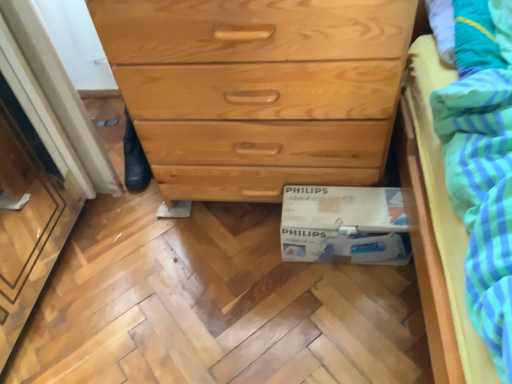
Question: Is white cardboard box at lower center with natural wood chest of drawers at center?

Choices:
 (A) yes
 (B) no

Answer: (B)

Question: Can you confirm if white cardboard box at lower center is positioned to the left of natural wood chest of drawers at center?

Choices:
 (A) no
 (B) yes

Answer: (A)

Question: From the image's perspective, is white cardboard box at lower center on natural wood chest of drawers at center?

Choices:
 (A) no
 (B) yes

Answer: (A)

Question: Is white cardboard box at lower center positioned far away from natural wood chest of drawers at center?

Choices:
 (A) yes
 (B) no

Answer: (B)

Question: Does white cardboard box at lower center have a smaller size compared to natural wood chest of drawers at center?

Choices:
 (A) yes
 (B) no

Answer: (A)

Question: Is white cardboard box at lower center oriented towards natural wood chest of drawers at center?

Choices:
 (A) no
 (B) yes

Answer: (A)

Question: Does natural wood chest of drawers at center have a lesser height compared to white cardboard box at lower center?

Choices:
 (A) no
 (B) yes

Answer: (A)

Question: From a real-world perspective, is natural wood chest of drawers at center over white cardboard box at lower center?

Choices:
 (A) no
 (B) yes

Answer: (B)

Question: From a real-world perspective, is natural wood chest of drawers at center located beneath white cardboard box at lower center?

Choices:
 (A) no
 (B) yes

Answer: (A)

Question: Is natural wood chest of drawers at center turned away from white cardboard box at lower center?

Choices:
 (A) yes
 (B) no

Answer: (B)

Question: Considering the relative sizes of natural wood chest of drawers at center and white cardboard box at lower center in the image provided, is natural wood chest of drawers at center smaller than white cardboard box at lower center?

Choices:
 (A) yes
 (B) no

Answer: (B)

Question: From the image's perspective, would you say natural wood chest of drawers at center is shown under white cardboard box at lower center?

Choices:
 (A) yes
 (B) no

Answer: (B)

Question: Is point (182, 175) positioned closer to the camera than point (410, 251)?

Choices:
 (A) closer
 (B) farther

Answer: (B)